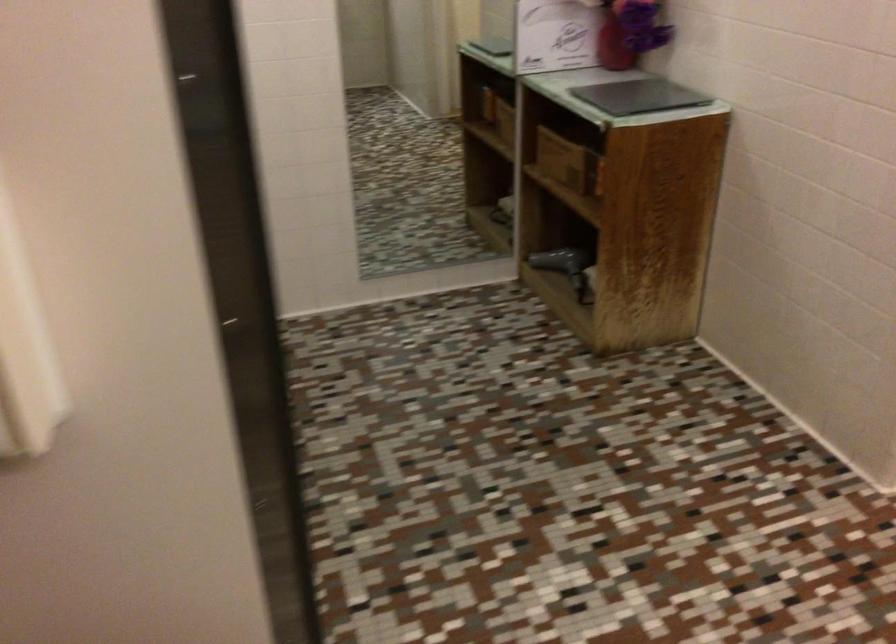
Where would you lift the red vase? Please return your answer as a coordinate pair (x, y).

(630, 32)